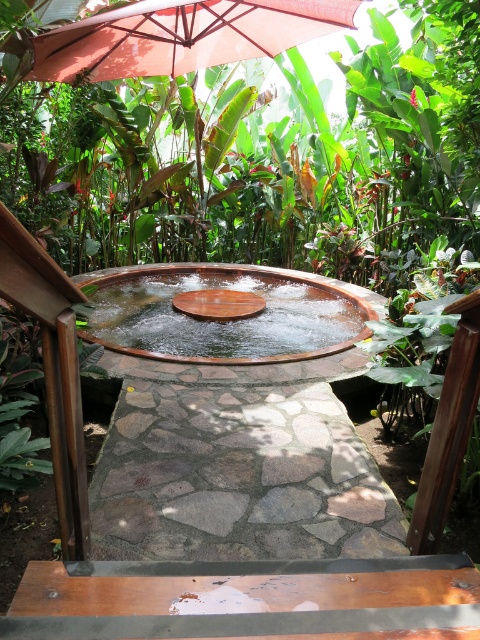
Question: Is brown wooden table at lower center smaller than matte red umbrella at upper center?

Choices:
 (A) no
 (B) yes

Answer: (B)

Question: Which object is farther from the camera taking this photo?

Choices:
 (A) brown wooden table at lower center
 (B) matte red umbrella at upper center

Answer: (B)

Question: Observing the image, what is the correct spatial positioning of brown wooden table at lower center in reference to matte red umbrella at upper center?

Choices:
 (A) below
 (B) above

Answer: (A)

Question: Is brown wooden table at lower center smaller than matte red umbrella at upper center?

Choices:
 (A) no
 (B) yes

Answer: (B)